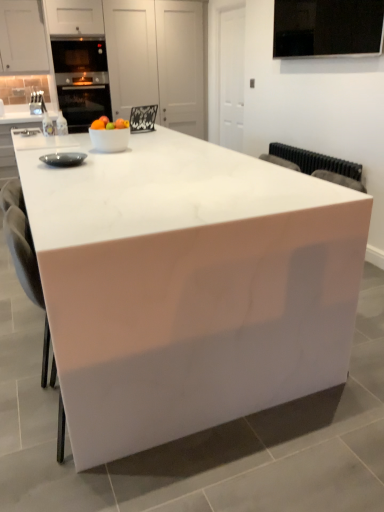
Image resolution: width=384 pixels, height=512 pixels. Identify the location of white glossy table at center. (187, 285).

Find the location of `white glossy bowl at center`. white glossy bowl at center is located at coordinates (110, 139).

Is matte black bowl at left next to white glossy bowl at center?

No, matte black bowl at left is not touching white glossy bowl at center.

From a real-world perspective, is matte black bowl at left on white glossy bowl at center?

Incorrect, from a real-world perspective, matte black bowl at left is lower than white glossy bowl at center.

Considering the points (64, 162) and (92, 137), which point is in front, point (64, 162) or point (92, 137)?

The point (64, 162) is more forward.

Can you confirm if matte black bowl at left is thinner than white glossy bowl at center?

Yes.

This screenshot has width=384, height=512. In the image, there is a white glossy bowl at center. Find the location of `appliance below it (from the image's perspective)`. appliance below it (from the image's perspective) is located at coordinates (64, 159).

What's the angular difference between white glossy bowl at center and matte black bowl at left's facing directions?

They differ by 0.000423 degrees in their facing directions.

Measure the distance between white glossy bowl at center and matte black bowl at left.

white glossy bowl at center and matte black bowl at left are 9.58 inches apart from each other.

Is point (99, 134) closer or farther from the camera than point (68, 160)?

Clearly, point (99, 134) is more distant from the camera than point (68, 160).

Looking at the image, does white glossy table at center seem bigger or smaller compared to matte black bowl at left?

Clearly, white glossy table at center is larger in size than matte black bowl at left.

Is white glossy table at center looking in the opposite direction of matte black bowl at left?

That's not correct — white glossy table at center is not looking away from matte black bowl at left.

Can you confirm if white glossy table at center is taller than matte black bowl at left?

Yes.

From the image's perspective, is white glossy table at center on matte black bowl at left?

No, from the image's perspective, white glossy table at center is not above matte black bowl at left.

Is matte black bowl at left facing away from white glossy table at center?

matte black bowl at left does not have its back to white glossy table at center.

Is matte black bowl at left inside the boundaries of white glossy table at center, or outside?

matte black bowl at left is contained in white glossy table at center.

Is matte black bowl at left taller or shorter than white glossy table at center?

matte black bowl at left is shorter than white glossy table at center.

Is white glossy bowl at center further to camera compared to white glossy table at center?

Yes, it is behind white glossy table at center.

Is white glossy bowl at center inside the boundaries of white glossy table at center, or outside?

white glossy bowl at center lies outside white glossy table at center.

From the picture: Can you tell me how much white glossy bowl at center and white glossy table at center differ in facing direction?

0.922 degrees separate the facing orientations of white glossy bowl at center and white glossy table at center.

Looking at their sizes, would you say white glossy bowl at center is wider or thinner than white glossy table at center?

In the image, white glossy bowl at center appears to be more narrow than white glossy table at center.

Consider the image. Would you say white glossy table at center is a long distance from white glossy bowl at center?

That's not correct — white glossy table at center is a little close to white glossy bowl at center.

The width and height of the screenshot is (384, 512). Find the location of `table on the right of white glossy bowl at center`. table on the right of white glossy bowl at center is located at coordinates (187, 285).

Is white glossy table at center turned away from white glossy bowl at center?

No, white glossy table at center is not facing the opposite direction of white glossy bowl at center.

Considering the relative sizes of white glossy table at center and white glossy bowl at center in the image provided, is white glossy table at center smaller than white glossy bowl at center?

No.

The height and width of the screenshot is (512, 384). In order to click on appliance on the left side of white glossy bowl at center in this screenshot , I will do `click(64, 159)`.

Image resolution: width=384 pixels, height=512 pixels. I want to click on appliance below the white glossy bowl at center (from a real-world perspective), so click(x=64, y=159).

Based on their spatial positions, is white glossy table at center or matte black bowl at left closer to white glossy bowl at center?

matte black bowl at left is positioned closer to the anchor white glossy bowl at center.

Estimate the real-world distances between objects in this image. Which object is further from matte black bowl at left, white glossy table at center or white glossy bowl at center?

Among the two, white glossy table at center is located further to matte black bowl at left.

Looking at the image, which one is located closer to matte black bowl at left, white glossy bowl at center or white glossy table at center?

white glossy bowl at center is positioned closer to the anchor matte black bowl at left.

Looking at the image, which one is located further to white glossy table at center, white glossy bowl at center or matte black bowl at left?

Based on the image, white glossy bowl at center appears to be further to white glossy table at center.

Looking at this image, which object lies nearer to the anchor point white glossy table at center, matte black bowl at left or white glossy bowl at center?

matte black bowl at left is positioned closer to the anchor white glossy table at center.

Which object lies nearer to the anchor point white glossy bowl at center, matte black bowl at left or white glossy table at center?

matte black bowl at left is closer to white glossy bowl at center.

The width and height of the screenshot is (384, 512). I want to click on appliance positioned between white glossy table at center and white glossy bowl at center from near to far, so (64, 159).